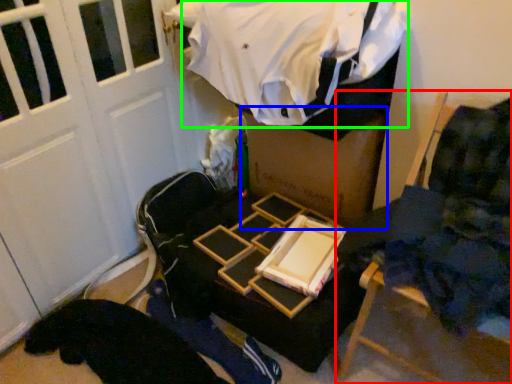
Question: Which is nearer to the furniture (highlighted by a red box)? box (highlighted by a blue box) or clothing (highlighted by a green box).

Choices:
 (A) box
 (B) clothing

Answer: (A)